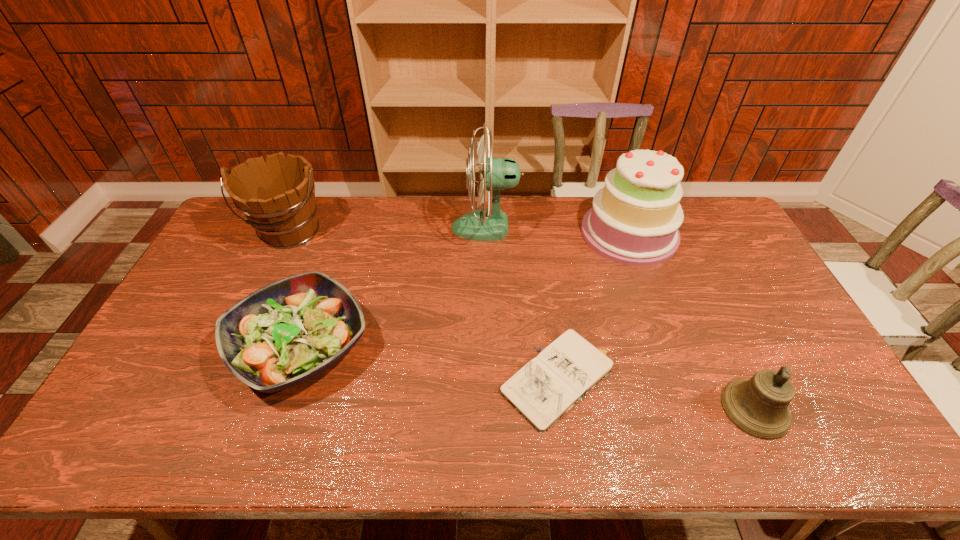
Locate an element on the screen. This screenshot has height=540, width=960. fan is located at coordinates (495, 174).

You are a GUI agent. You are given a task and a screenshot of the screen. Output one action in this format:
    pyautogui.click(x=<x>, y=<y>)
    Task: Click on the cake
    This screenshot has height=540, width=960.
    Given the screenshot: What is the action you would take?
    pyautogui.click(x=634, y=220)

Find the location of a particular element. The image size is (960, 540). wine bucket is located at coordinates (277, 196).

You are a GUI agent. You are given a task and a screenshot of the screen. Output one action in this format:
    pyautogui.click(x=<x>, y=<y>)
    Task: Click on the bell
    
    Given the screenshot: What is the action you would take?
    pyautogui.click(x=758, y=406)

At what (x,y) coordinates should I click in order to perform the action: click on the fifth tallest object. Please return your answer as a coordinate pair (x, y). Looking at the image, I should click on (289, 331).

Find the location of a particular element. This screenshot has height=540, width=960. notebook is located at coordinates (548, 386).

I want to click on free region located in front of the fan, directing airflow, so 379,227.

Identify the location of vacant space located in front of the fan, directing airflow. This screenshot has height=540, width=960. (407, 227).

Where is `free location located 0.350m in front of the fan, directing airflow`? The width and height of the screenshot is (960, 540). free location located 0.350m in front of the fan, directing airflow is located at coordinates (354, 227).

The image size is (960, 540). Identify the location of vacant region located 0.260m on the left of the cake. (509, 233).